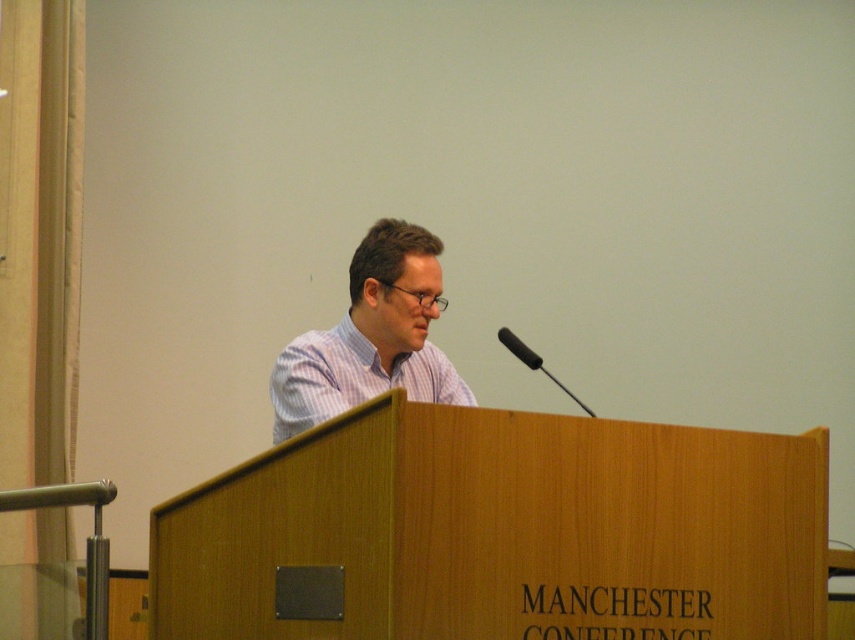
Based on the photo, between white striped shirt at center and black matte microphone at center, which one appears on the left side from the viewer's perspective?

Positioned to the left is white striped shirt at center.

Can you confirm if white striped shirt at center is wider than black matte microphone at center?

Indeed, white striped shirt at center has a greater width compared to black matte microphone at center.

In order to click on white striped shirt at center in this screenshot , I will do `click(370, 337)`.